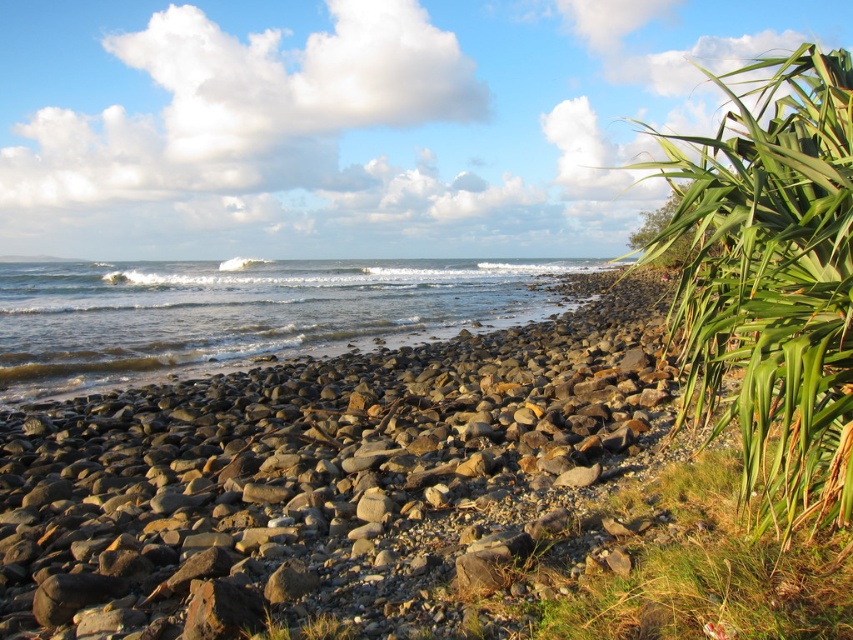
Which is behind, point (820, 156) or point (38, 276)?

Positioned behind is point (38, 276).

Can you confirm if green leafy plant at right is thinner than clear water at center?

Correct, green leafy plant at right's width is less than clear water at center's.

Locate an element on the screen. The image size is (853, 640). green leafy plant at right is located at coordinates (770, 280).

Does green leafy plant at right appear under green grass at lower center?

No, green leafy plant at right is not below green grass at lower center.

Who is more forward, (828, 125) or (268, 618)?

Point (828, 125) is in front.

Who is more distant from viewer, [831,387] or [326,621]?

The point [326,621] is behind.

Find the location of `green leafy plant at right`. green leafy plant at right is located at coordinates (770, 280).

Measure the distance between point (x=376, y=273) and camera.

The distance of point (x=376, y=273) from camera is 209.38 feet.

Can you confirm if clear water at center is taller than green grass at lower center?

Correct, clear water at center is much taller as green grass at lower center.

Who is more forward, (x=523, y=266) or (x=253, y=636)?

Point (x=253, y=636)

The width and height of the screenshot is (853, 640). I want to click on clear water at center, so click(242, 310).